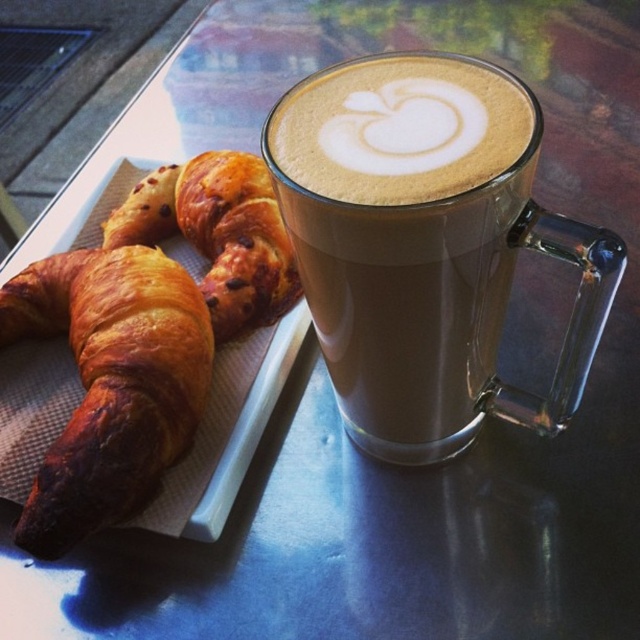
You are taking a photo of the breakfast scene. You want to focus on the croissants first and then the coffee mug. Which point should you focus on first, point (76,456) or point (499,152)?

Point (76,456) is further to the camera than point (499,152). So you should focus on point (76,456) first since it is closer to the camera.

You are a barista preparing a coffee order. You need to place the brown frothy latte art at upper center and the golden brown flaky croissant at left on a tray. The tray has a maximum capacity of 10 inches in width. The latte art is 3 inches wide, and the croissant is 5 inches wide. Can both items fit side by side on the tray without overlapping?

The brown frothy latte art at upper center is 3 inches wide and the golden brown flaky croissant at left is 5 inches wide. Combined, they total 8 inches, which is under the 10 inch limit. Both items can fit side by side on the tray without overlapping.